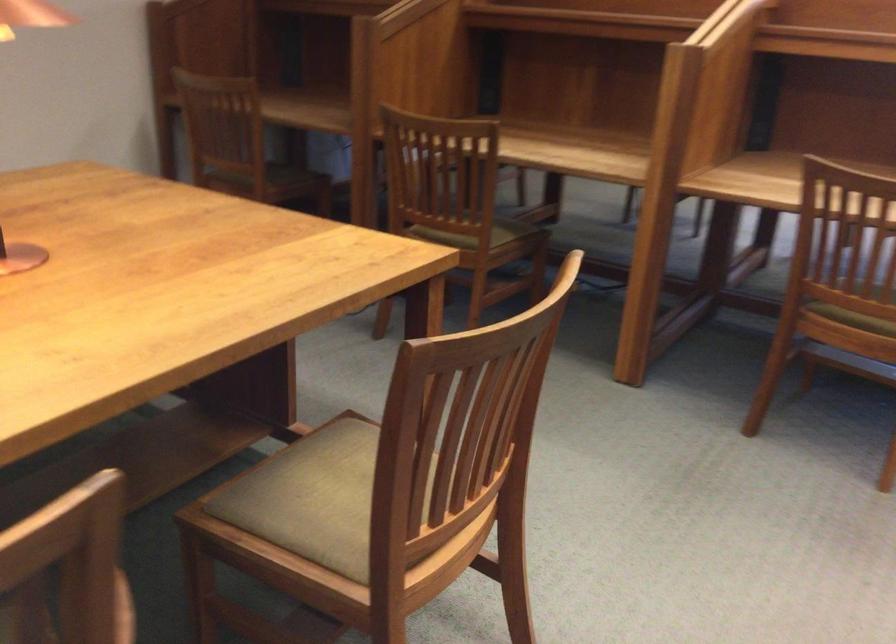
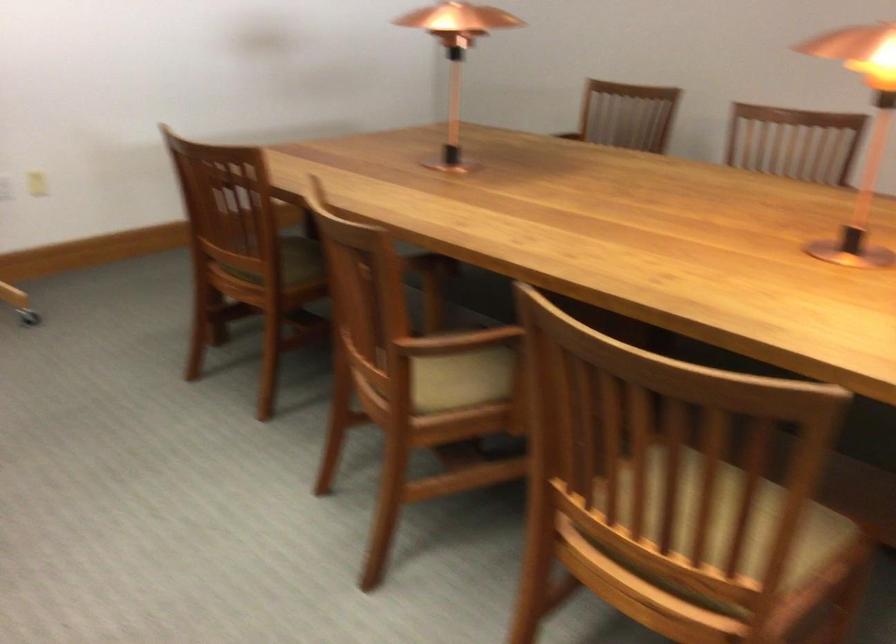
In the second image, find the point that corresponds to pixel 503 421 in the first image.

(728, 526)